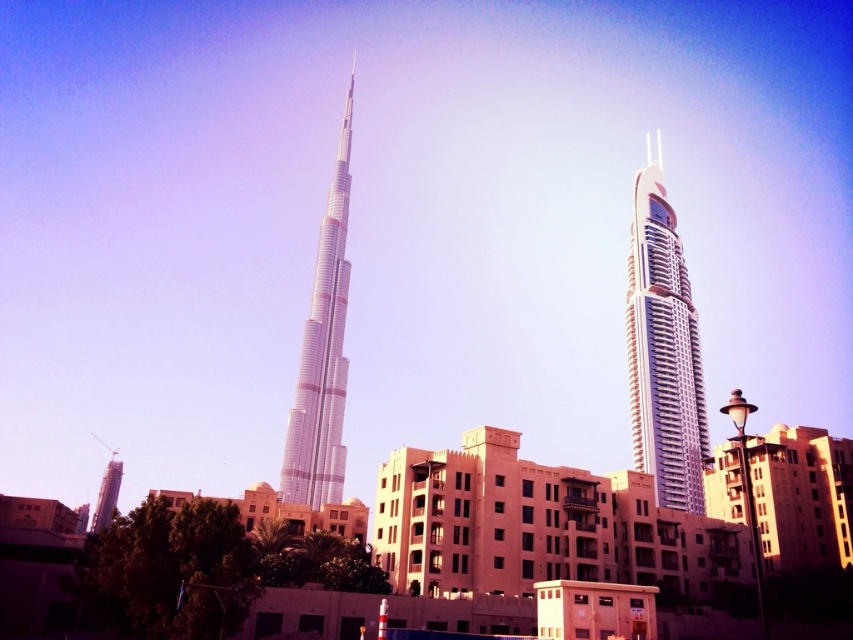
Question: In this image, where is shiny glass skyscraper at right located relative to silver metallic tower at center?

Choices:
 (A) left
 (B) right

Answer: (B)

Question: Is shiny glass skyscraper at right below silver metallic tower at center?

Choices:
 (A) no
 (B) yes

Answer: (A)

Question: Among these objects, which one is farthest from the camera?

Choices:
 (A) silver metallic tower at center
 (B) shiny glass skyscraper at right

Answer: (A)

Question: Which object appears closest to the camera in this image?

Choices:
 (A) silver metallic tower at center
 (B) shiny glass skyscraper at right

Answer: (B)

Question: Among these points, which one is farthest from the camera?

Choices:
 (A) (339, 188)
 (B) (688, 460)

Answer: (A)

Question: Can you confirm if shiny glass skyscraper at right is positioned to the left of silver metallic tower at center?

Choices:
 (A) yes
 (B) no

Answer: (B)